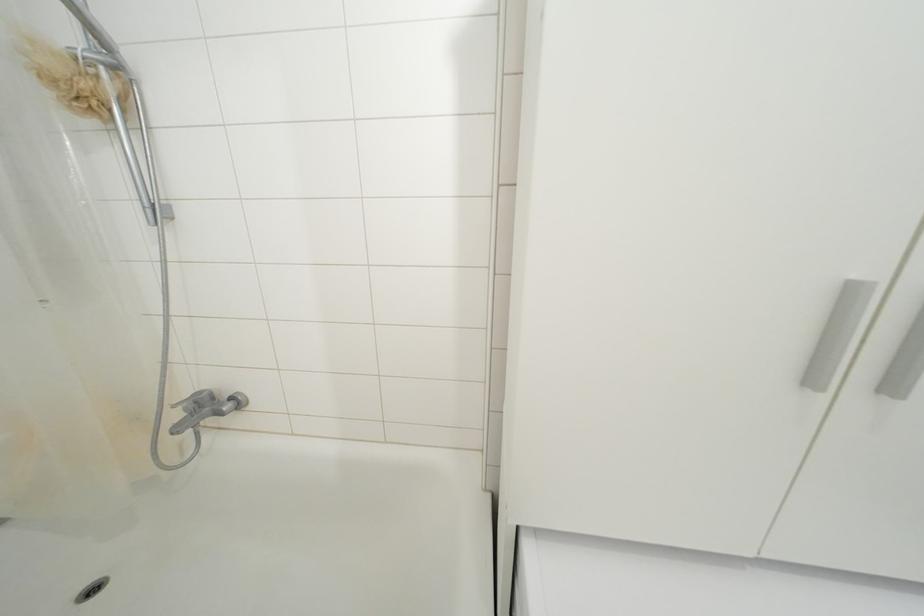
Locate an element on the screen. shower faucet handle is located at coordinates (196, 398).